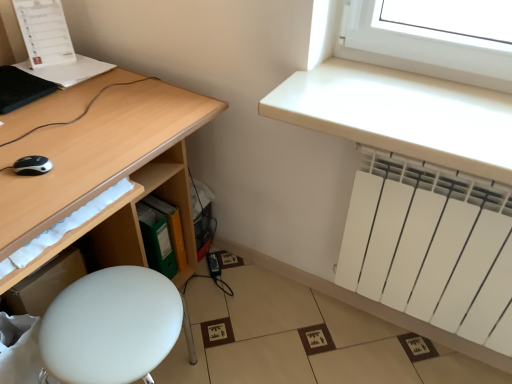
Question: From a real-world perspective, does matte wood desk at left stand above white matte radiator at lower right?

Choices:
 (A) no
 (B) yes

Answer: (B)

Question: Can you confirm if matte wood desk at left is smaller than white matte radiator at lower right?

Choices:
 (A) no
 (B) yes

Answer: (A)

Question: Considering the relative sizes of matte wood desk at left and white matte radiator at lower right in the image provided, is matte wood desk at left wider than white matte radiator at lower right?

Choices:
 (A) yes
 (B) no

Answer: (A)

Question: Could you tell me if matte wood desk at left is turned towards white matte radiator at lower right?

Choices:
 (A) yes
 (B) no

Answer: (A)

Question: Is matte wood desk at left behind white matte radiator at lower right?

Choices:
 (A) no
 (B) yes

Answer: (A)

Question: Choose the correct answer: Is matte wood desk at left inside green plastic file at lower center or outside it?

Choices:
 (A) inside
 (B) outside

Answer: (B)

Question: Is matte wood desk at left bigger or smaller than green plastic file at lower center?

Choices:
 (A) big
 (B) small

Answer: (A)

Question: Is point (223, 109) positioned closer to the camera than point (173, 216)?

Choices:
 (A) farther
 (B) closer

Answer: (B)

Question: From a real-world perspective, is matte wood desk at left positioned above or below green plastic file at lower center?

Choices:
 (A) below
 (B) above

Answer: (B)

Question: Is matte wood desk at left taller or shorter than white matte radiator at upper right?

Choices:
 (A) short
 (B) tall

Answer: (B)

Question: In terms of size, does matte wood desk at left appear bigger or smaller than white matte radiator at upper right?

Choices:
 (A) big
 (B) small

Answer: (A)

Question: Considering the relative positions of matte wood desk at left and white matte radiator at upper right in the image provided, is matte wood desk at left to the left or to the right of white matte radiator at upper right?

Choices:
 (A) right
 (B) left

Answer: (B)

Question: Is point (180, 92) closer or farther from the camera than point (492, 160)?

Choices:
 (A) farther
 (B) closer

Answer: (A)

Question: Considering their positions, is white matte stool at lower left located in front of or behind white matte radiator at upper right?

Choices:
 (A) behind
 (B) front

Answer: (B)

Question: From the image's perspective, is white matte stool at lower left located above or below white matte radiator at upper right?

Choices:
 (A) below
 (B) above

Answer: (A)